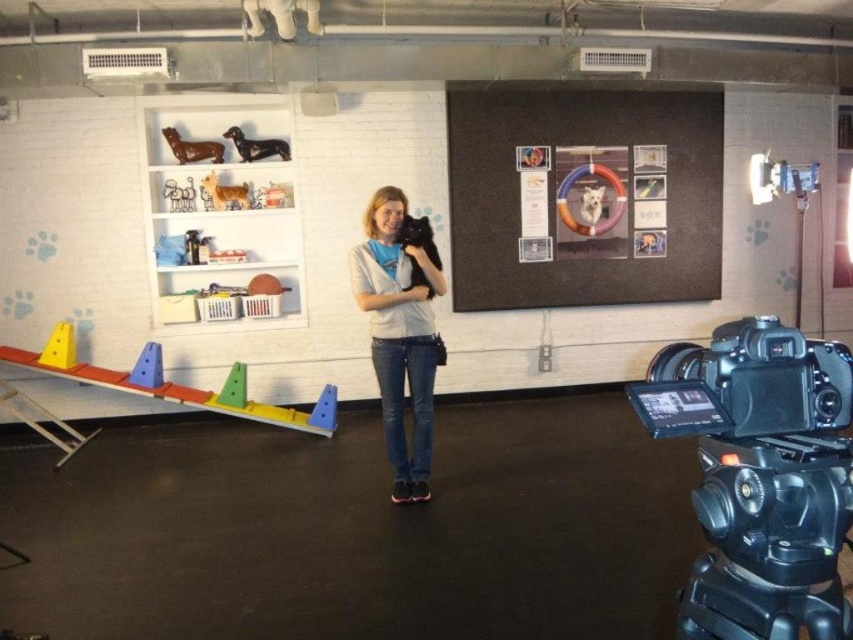
Question: Observing the image, what is the correct spatial positioning of white matte bookshelf at upper left in reference to black plastic tripod at lower right?

Choices:
 (A) right
 (B) left

Answer: (B)

Question: Which object is farther from the camera taking this photo?

Choices:
 (A) black plastic video camera at lower right
 (B) white matte bookshelf at upper left
 (C) black plastic tripod at lower right
 (D) denim jeans at center

Answer: (B)

Question: Does black plastic video camera at lower right appear on the left side of black plastic tripod at lower right?

Choices:
 (A) no
 (B) yes

Answer: (B)

Question: Which point is closer to the camera taking this photo?

Choices:
 (A) (419, 436)
 (B) (225, 196)

Answer: (A)

Question: Does black plastic video camera at lower right have a greater width compared to denim jeans at center?

Choices:
 (A) yes
 (B) no

Answer: (A)

Question: Which point appears closest to the camera in this image?

Choices:
 (A) (210, 192)
 (B) (786, 634)
 (C) (430, 388)
 (D) (677, 598)

Answer: (B)